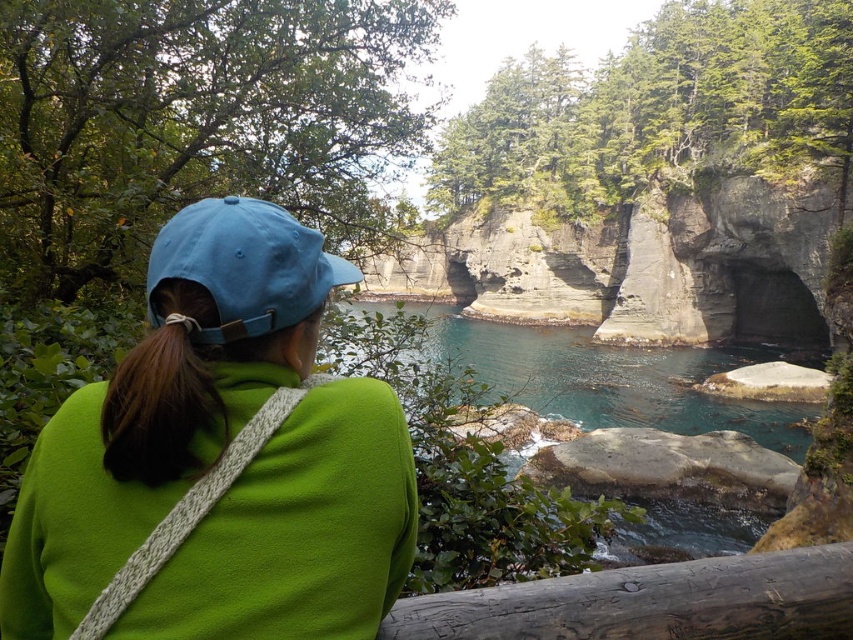
Question: In this image, where is blue fabric cap at upper left located relative to brown hair at back?

Choices:
 (A) above
 (B) below

Answer: (A)

Question: Which is nearer to the brown hair at back?

Choices:
 (A) matte blue cap at upper left
 (B) wooden rail at lower center
 (C) blue fabric cap at upper left

Answer: (A)

Question: Among these objects, which one is nearest to the camera?

Choices:
 (A) wooden rail at lower center
 (B) brown hair at back
 (C) blue fabric cap at upper left

Answer: (A)

Question: Observing the image, what is the correct spatial positioning of wooden rail at lower center in reference to brown hair at back?

Choices:
 (A) above
 (B) below

Answer: (B)

Question: Is wooden rail at lower center positioned before blue fabric cap at upper left?

Choices:
 (A) yes
 (B) no

Answer: (A)

Question: Which point is closer to the camera?

Choices:
 (A) (129, 410)
 (B) (231, 282)
 (C) (740, 561)
 (D) (309, 435)

Answer: (A)